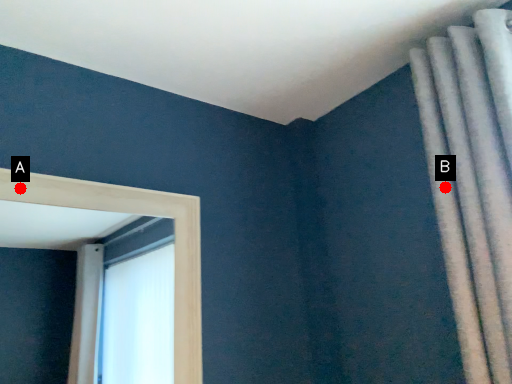
Question: Two points are circled on the image, labeled by A and B beside each circle. Which point is closer to the camera?

Choices:
 (A) A is closer
 (B) B is closer

Answer: (A)